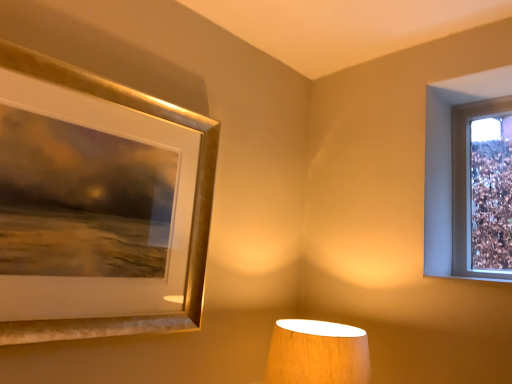
Question: Can you confirm if wooden lampshade at lower center is taller than gold metallic picture frame at upper left?

Choices:
 (A) yes
 (B) no

Answer: (B)

Question: Would you say gold metallic picture frame at upper left is part of wooden lampshade at lower center's contents?

Choices:
 (A) no
 (B) yes

Answer: (A)

Question: Can you confirm if wooden lampshade at lower center is shorter than gold metallic picture frame at upper left?

Choices:
 (A) yes
 (B) no

Answer: (A)

Question: From a real-world perspective, does wooden lampshade at lower center stand above gold metallic picture frame at upper left?

Choices:
 (A) yes
 (B) no

Answer: (B)

Question: Can you confirm if wooden lampshade at lower center is bigger than gold metallic picture frame at upper left?

Choices:
 (A) no
 (B) yes

Answer: (A)

Question: Is wooden lampshade at lower center wider than gold metallic picture frame at upper left?

Choices:
 (A) yes
 (B) no

Answer: (A)

Question: From the image's perspective, is gold metallic picture frame at upper left beneath wooden lampshade at lower center?

Choices:
 (A) no
 (B) yes

Answer: (A)

Question: Is gold metallic picture frame at upper left at the right side of wooden lampshade at lower center?

Choices:
 (A) no
 (B) yes

Answer: (A)

Question: Is wooden lampshade at lower center located within gold metallic picture frame at upper left?

Choices:
 (A) no
 (B) yes

Answer: (A)

Question: Is gold metallic picture frame at upper left positioned in front of wooden lampshade at lower center?

Choices:
 (A) yes
 (B) no

Answer: (A)

Question: From a real-world perspective, is gold metallic picture frame at upper left positioned over wooden lampshade at lower center based on gravity?

Choices:
 (A) no
 (B) yes

Answer: (B)

Question: Is gold metallic picture frame at upper left thinner than wooden lampshade at lower center?

Choices:
 (A) yes
 (B) no

Answer: (A)

Question: Looking at their shapes, would you say gold metallic picture frame at upper left is wider or thinner than wooden lampshade at lower center?

Choices:
 (A) thin
 (B) wide

Answer: (A)